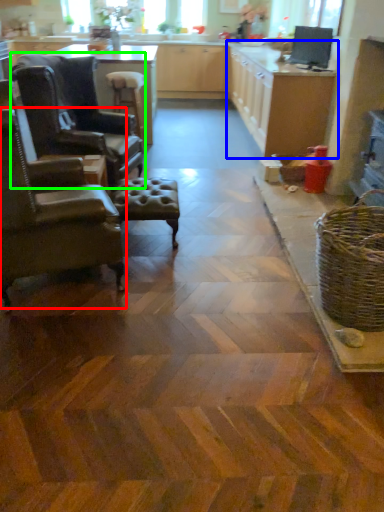
Question: Based on their relative distances, which object is farther from chair (highlighted by a red box)? Choose from cabinetry (highlighted by a blue box) and chair (highlighted by a green box).

Choices:
 (A) cabinetry
 (B) chair

Answer: (A)